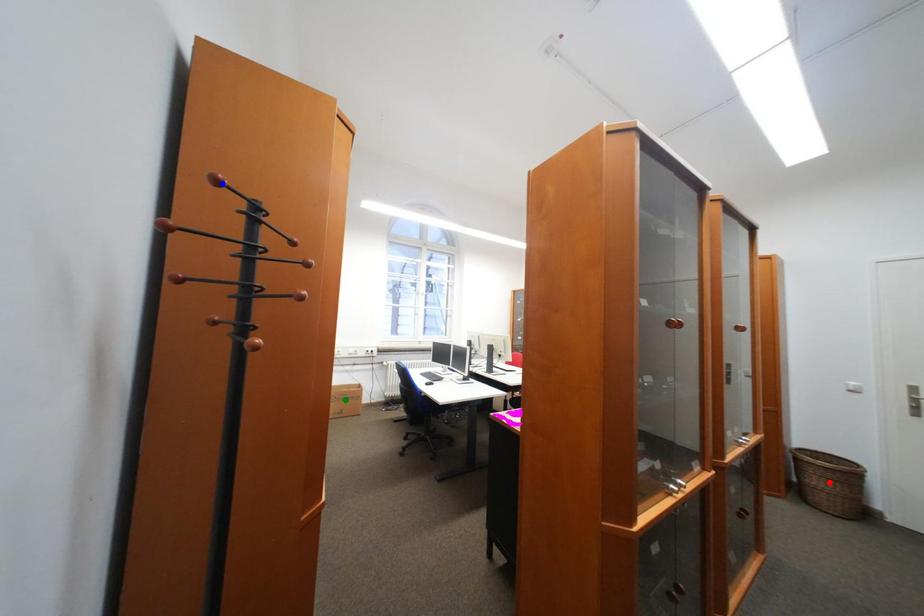
Consider the image. Order these from farthest to nearest:
red point
green point
blue point

1. green point
2. red point
3. blue point